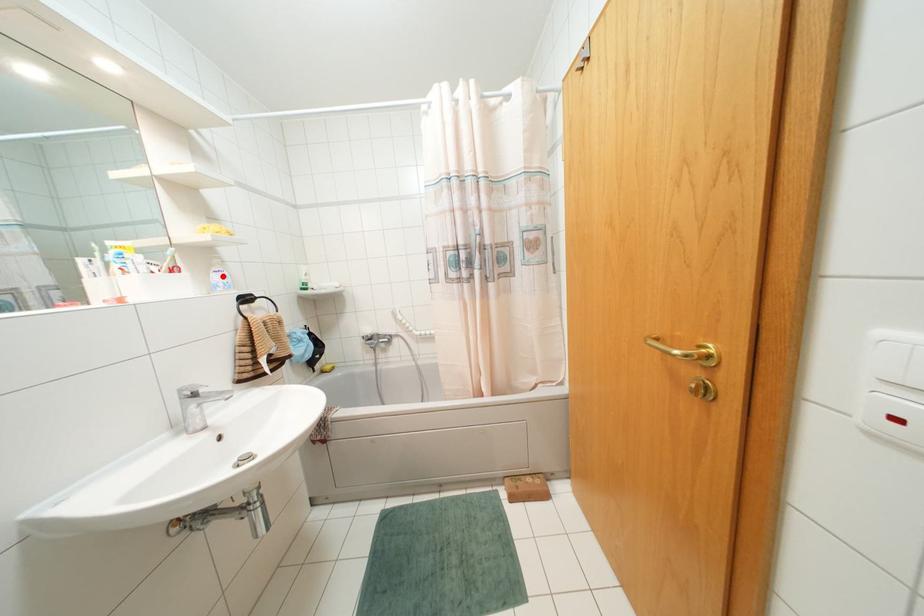
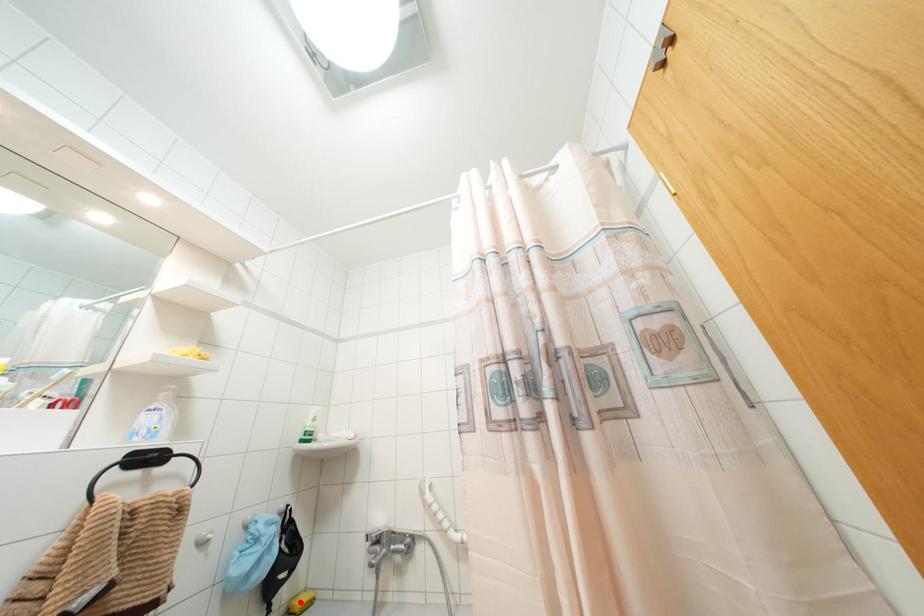
I am providing you with two images of the same scene from different viewpoints. A red point is marked on the first image and another point is marked on the second image. Is the marked point in image1 the same physical position as the marked point in image2?

No